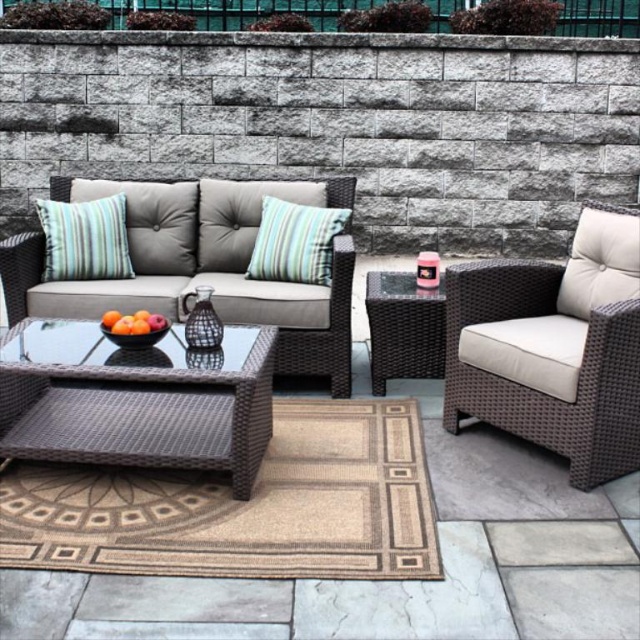
You are standing on the patio and want to pick up an object. You notice two points marked in the image. Which point, point 1 at coordinates (125, 428) or point 2 at coordinates (99, 237), is closer to you?

Point 1 at coordinates (125, 428) is closer to you than point 2 at coordinates (99, 237).

You are planning to place a new decorative item on the glossy wicker table at center. However, you want to ensure it won not block the view of the striped fabric pillow at upper left. Based on their sizes, is this possible?

The glossy wicker table at center might be wider than striped fabric pillow at upper left, so placing the item on the table could potentially block the view of the pillow depending on the placement. To avoid blocking the view, ensure the item is placed towards the edge of the table away from the pillow.

You are planning to place a small potted plant on the glossy wicker table at center. Considering the height of the striped fabric pillow at center, will the plant be visible from above the pillow?

The glossy wicker table at center is taller than the striped fabric pillow at center, so the potted plant placed on the table will be visible above the pillow.